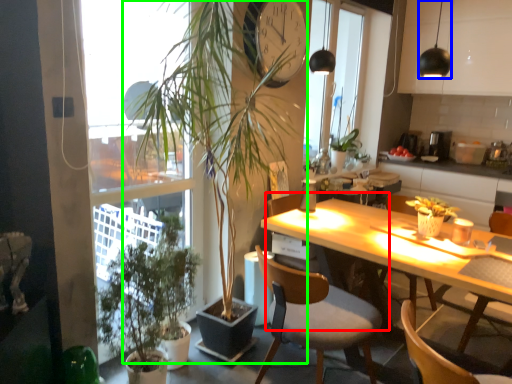
Question: Which is nearer to the chair (highlighted by a red box)? lamp (highlighted by a blue box) or houseplant (highlighted by a green box).

Choices:
 (A) lamp
 (B) houseplant

Answer: (B)